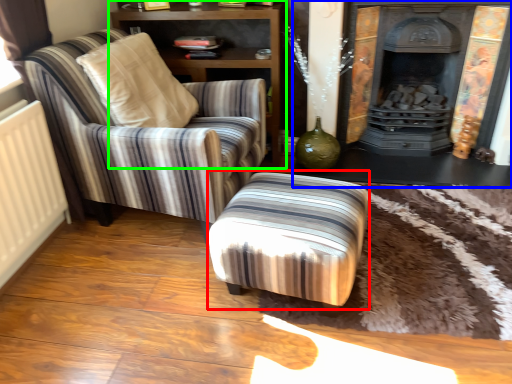
Question: Which is nearer to the stool (highlighted by a red box)? fireplace (highlighted by a blue box) or shelf (highlighted by a green box).

Choices:
 (A) fireplace
 (B) shelf

Answer: (A)